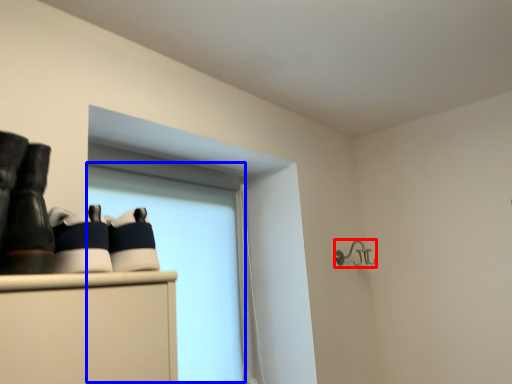
Question: Which object is closer to the camera taking this photo, shower (highlighted by a red box) or window screen (highlighted by a blue box)?

Choices:
 (A) shower
 (B) window screen

Answer: (B)